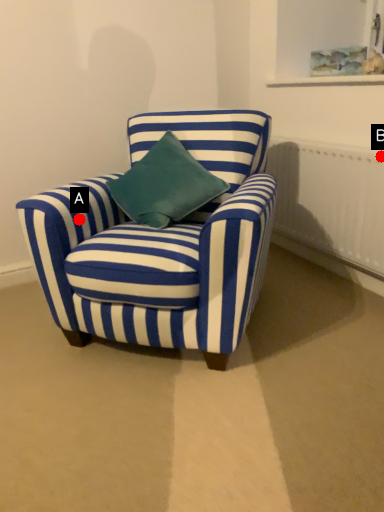
Question: Two points are circled on the image, labeled by A and B beside each circle. Which point is farther to the camera?

Choices:
 (A) A is further
 (B) B is further

Answer: (B)